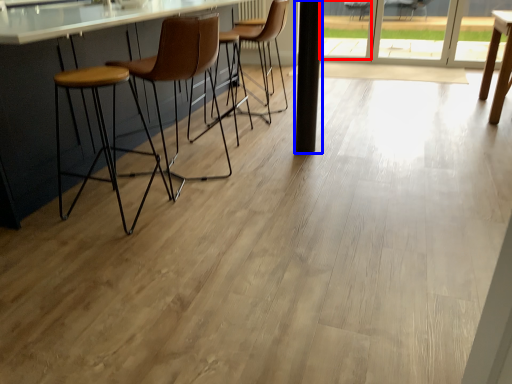
Question: Which of the following is the closest to the observer, window (highlighted by a red box) or pillar (highlighted by a blue box)?

Choices:
 (A) window
 (B) pillar

Answer: (B)